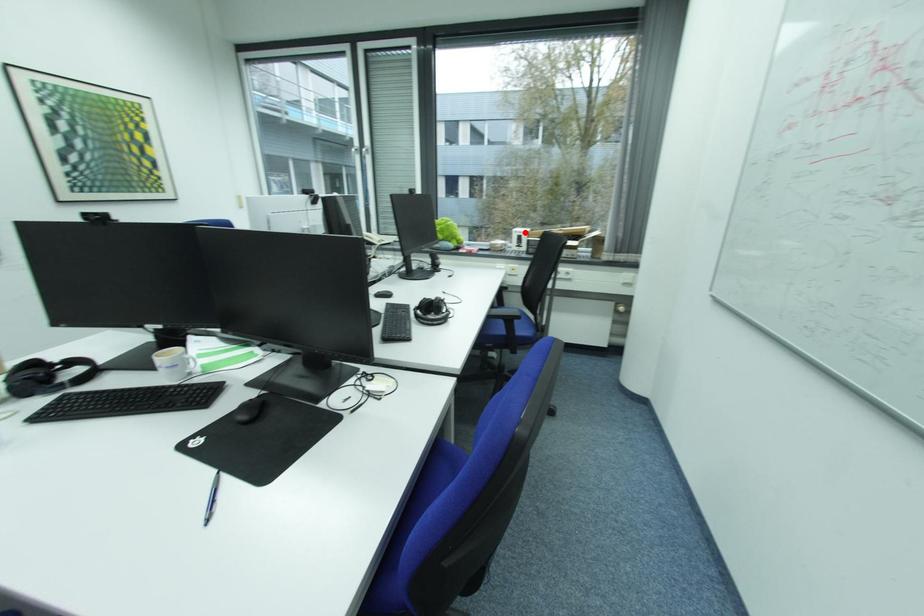
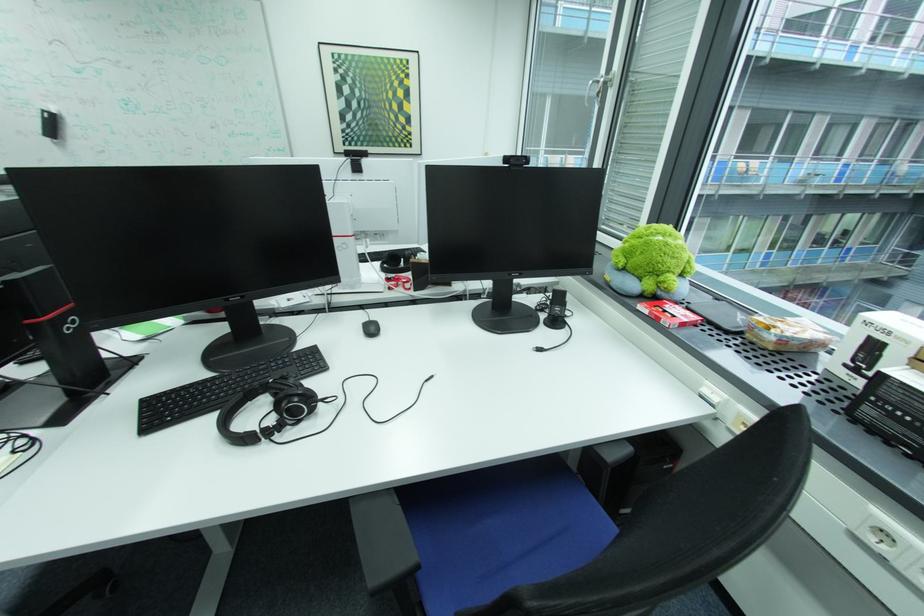
Find the pixel in the second image that matches the highlighted location in the first image.

(876, 323)